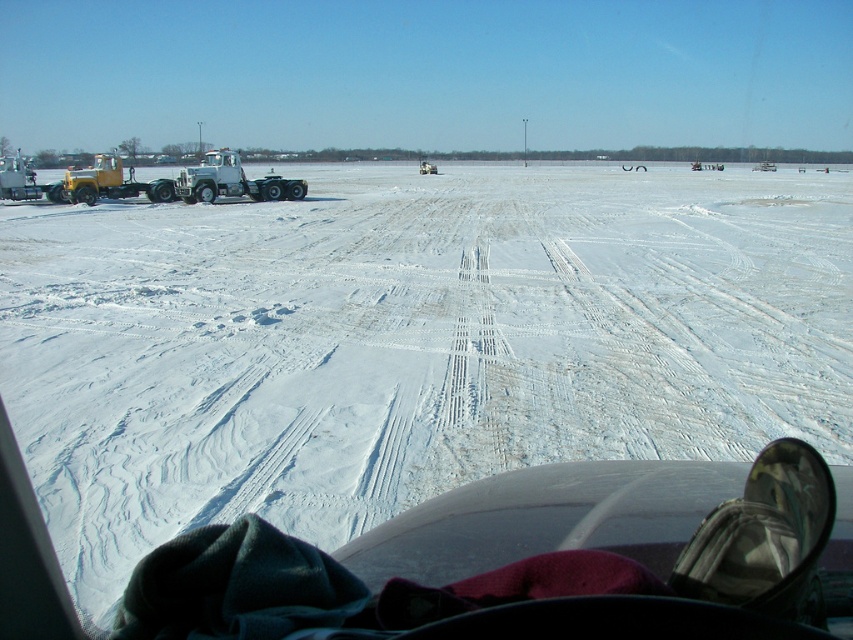
What are the coordinates of the white powdery snow at center?

The white powdery snow at center is located at coordinates point (409, 340).

You are a delivery driver who needs to park your truck on the white powdery snow at center. However, there is a white matte trailer truck at left in the way. Based on the scene, can you drive your truck directly to the snow area without moving the other truck?

The white powdery snow at center is located below the white matte trailer truck at left, meaning the truck is positioned above the snow area. Since the truck is blocking the direct path, you would need to move it or find an alternative route to access the snow area.